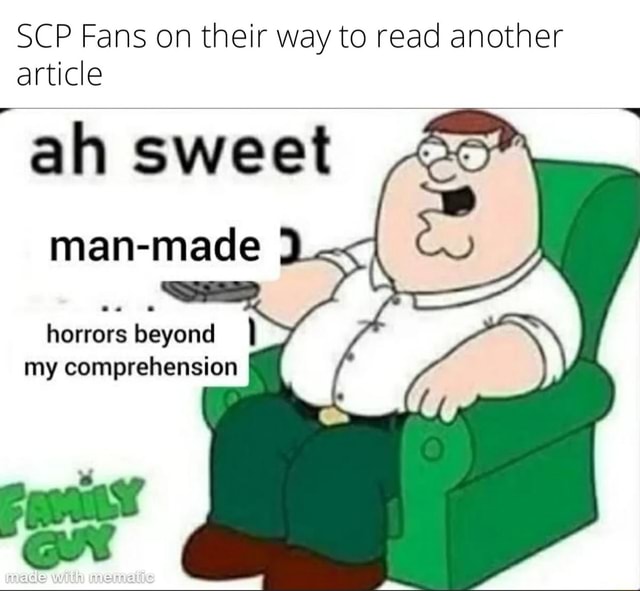
Identify the location of remote. This screenshot has height=591, width=640. point(198,291).